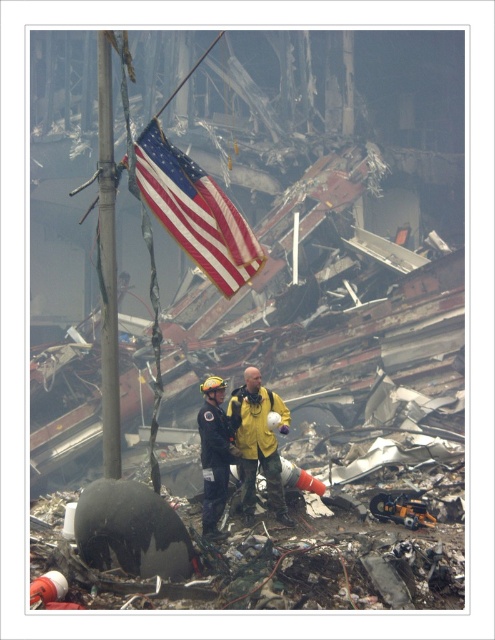
You are a photographer at the disaster site. You want to capture a photo that includes both the american flag at center and the yellow matte jacket at center. Which object should you focus on first to ensure both are in frame?

The american flag at center is closer to the viewer than the yellow matte jacket at center, so you should focus on the american flag at center first to ensure both are in frame.

You are a photographer at the disaster site. You want to capture a photo that includes both the american flag at center and the yellow matte jacket at center. Based on their positions, which object should you adjust your camera angle to focus on first to ensure both are in frame?

The american flag at center is positioned on the left side of yellow matte jacket at center. To include both in the frame, focus on the yellow matte jacket at center first, as it is on the right, ensuring the american flag at center remains visible to its left.

You are a rescue worker trying to locate a survivor in the disaster area. You see the yellow matte jacket at center and the black matte uniform at center. Which one is positioned to the right side?

The yellow matte jacket at center is to the right of the black matte uniform at center.